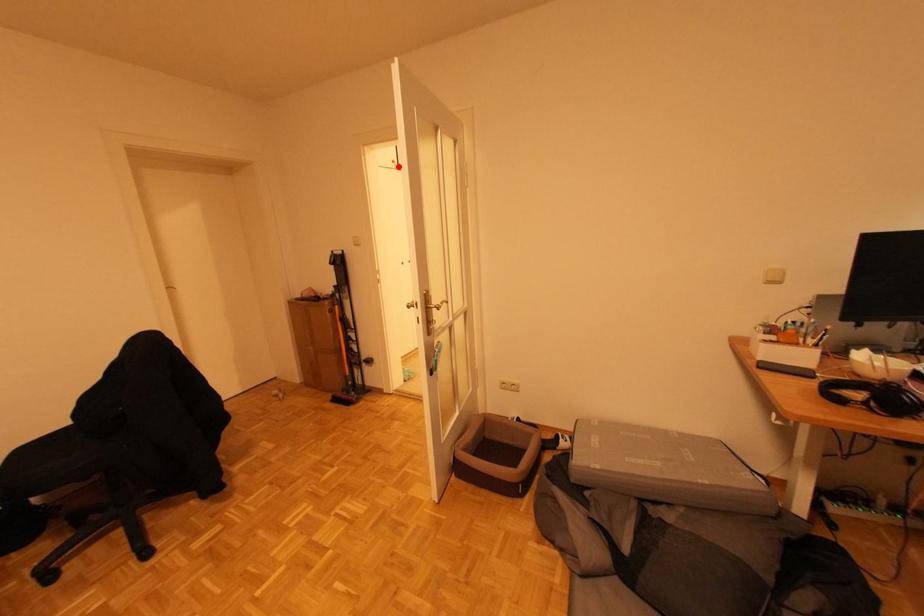
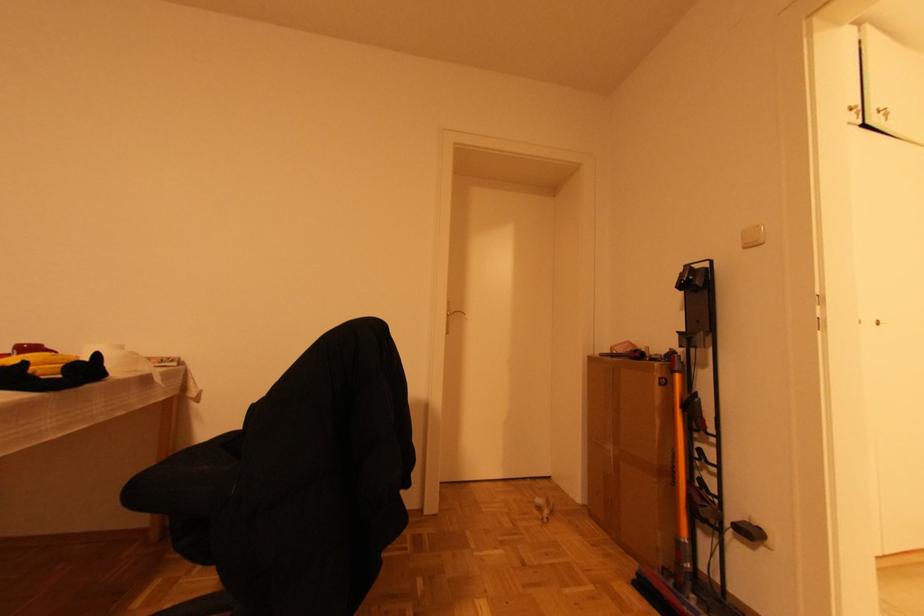
The point at the highlighted location is marked in the first image. Where is the corresponding point in the second image?

(859, 114)